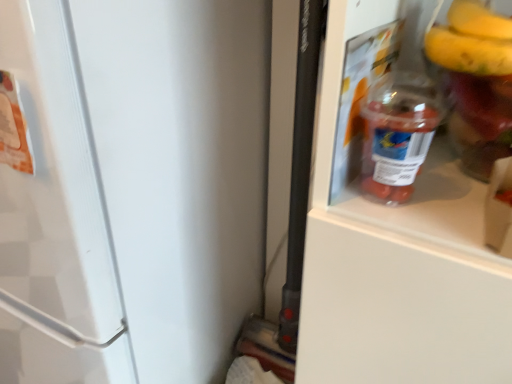
Question: Is translucent plastic bottle at center completely or partially inside white matte refrigerator door at right?

Choices:
 (A) yes
 (B) no

Answer: (B)

Question: Does white matte refrigerator door at right have a smaller size compared to translucent plastic bottle at center?

Choices:
 (A) yes
 (B) no

Answer: (B)

Question: Is white matte refrigerator door at right wider than translucent plastic bottle at center?

Choices:
 (A) no
 (B) yes

Answer: (B)

Question: Is translucent plastic bottle at center at the back of white matte refrigerator door at right?

Choices:
 (A) no
 (B) yes

Answer: (A)

Question: Is white matte refrigerator door at right far from translucent plastic bottle at center?

Choices:
 (A) no
 (B) yes

Answer: (A)

Question: Can you see white matte refrigerator door at right touching translucent plastic bottle at center?

Choices:
 (A) no
 (B) yes

Answer: (A)

Question: Does translucent plastic bottle at center turn towards white matte refrigerator door at right?

Choices:
 (A) yes
 (B) no

Answer: (B)

Question: Does translucent plastic bottle at center have a lesser width compared to white matte refrigerator door at right?

Choices:
 (A) yes
 (B) no

Answer: (A)

Question: From the image's perspective, does translucent plastic bottle at center appear lower than white matte refrigerator door at right?

Choices:
 (A) yes
 (B) no

Answer: (B)

Question: From a real-world perspective, is translucent plastic bottle at center located beneath white matte refrigerator door at right?

Choices:
 (A) no
 (B) yes

Answer: (A)

Question: From a real-world perspective, is translucent plastic bottle at center located higher than white matte refrigerator door at right?

Choices:
 (A) yes
 (B) no

Answer: (A)

Question: Is there a large distance between translucent plastic bottle at center and white matte refrigerator door at right?

Choices:
 (A) yes
 (B) no

Answer: (B)

Question: From the image's perspective, is white matte refrigerator door at right above or below translucent plastic bottle at center?

Choices:
 (A) below
 (B) above

Answer: (A)